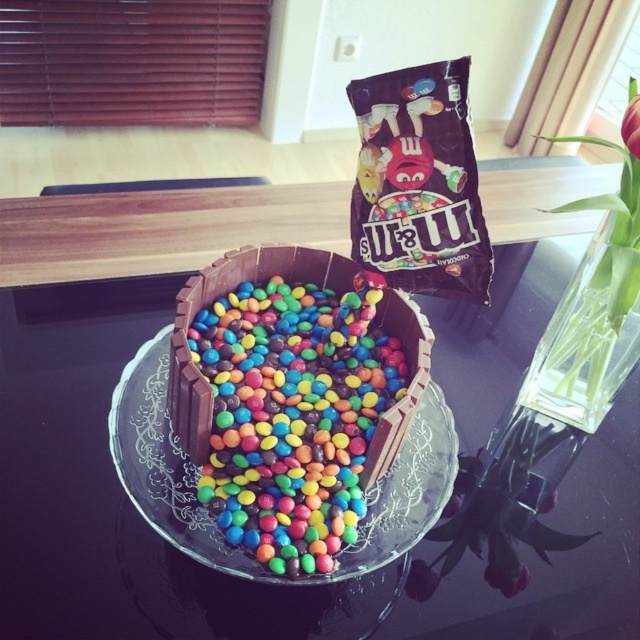
Question: Is transparent glass table at center above transparent glass plate at center?

Choices:
 (A) no
 (B) yes

Answer: (B)

Question: Which of the following is the closest to the observer?

Choices:
 (A) (70, 618)
 (B) (154, 483)

Answer: (A)

Question: Is transparent glass table at center further to the viewer compared to transparent glass plate at center?

Choices:
 (A) no
 (B) yes

Answer: (A)

Question: Can you confirm if transparent glass table at center is positioned below transparent glass plate at center?

Choices:
 (A) no
 (B) yes

Answer: (A)

Question: Which point is farther to the camera?

Choices:
 (A) (534, 275)
 (B) (435, 387)

Answer: (A)